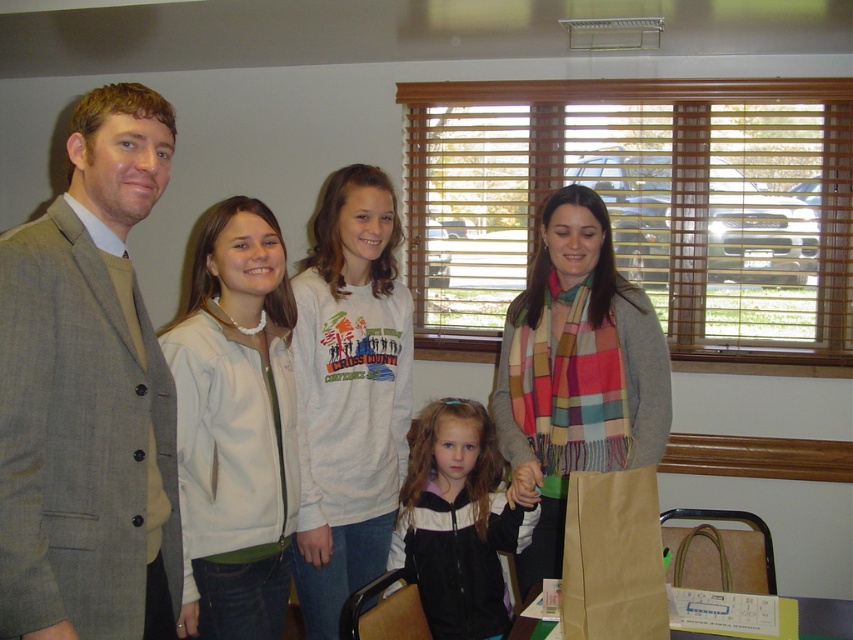
Question: Which object is closer to the camera taking this photo?

Choices:
 (A) gray wool suit at left
 (B) multicolored plaid scarf at center
 (C) brown paper bag at lower center
 (D) white cotton sweatshirt at center

Answer: (A)

Question: Can you confirm if white cotton sweatshirt at center is positioned above multicolored plaid scarf at center?

Choices:
 (A) yes
 (B) no

Answer: (B)

Question: Is white matte jacket at center below brown paper bag at lower center?

Choices:
 (A) no
 (B) yes

Answer: (A)

Question: Which point is closer to the camera?

Choices:
 (A) (659, 624)
 (B) (78, 134)
 (C) (276, 540)
 (D) (602, 413)

Answer: (A)

Question: Is multicolored plaid scarf at center below black matte jacket at center?

Choices:
 (A) yes
 (B) no

Answer: (B)

Question: Which object appears closest to the camera in this image?

Choices:
 (A) gray wool suit at left
 (B) white cotton sweatshirt at center
 (C) white matte jacket at center
 (D) multicolored plaid scarf at center

Answer: (A)